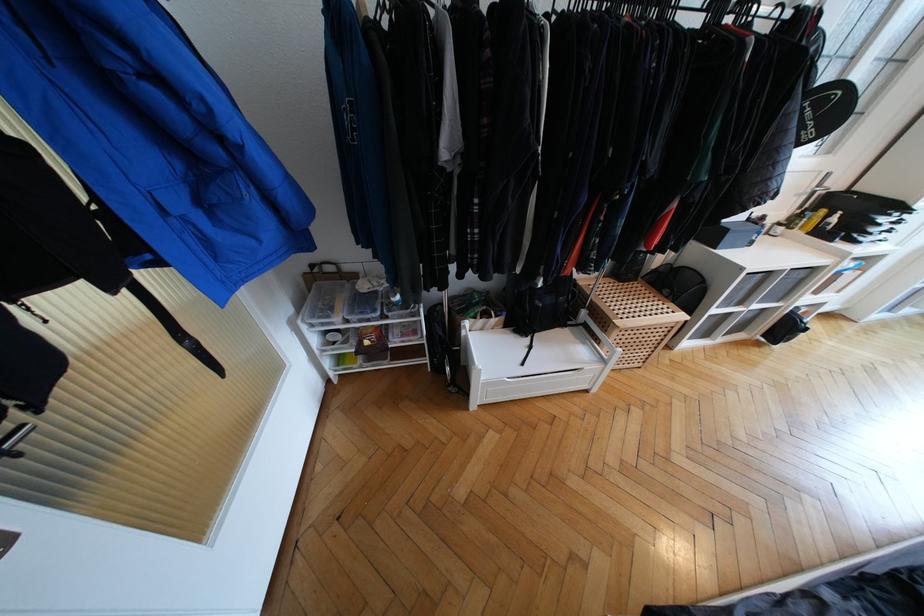
What do you see at coordinates (15, 440) in the screenshot? This screenshot has width=924, height=616. I see `the black spray bottle trigger` at bounding box center [15, 440].